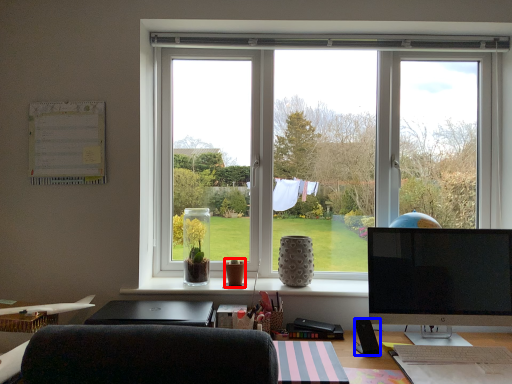
Question: Which of the following is the closest to the observer, vase (highlighted by a red box) or loudspeaker (highlighted by a blue box)?

Choices:
 (A) vase
 (B) loudspeaker

Answer: (B)